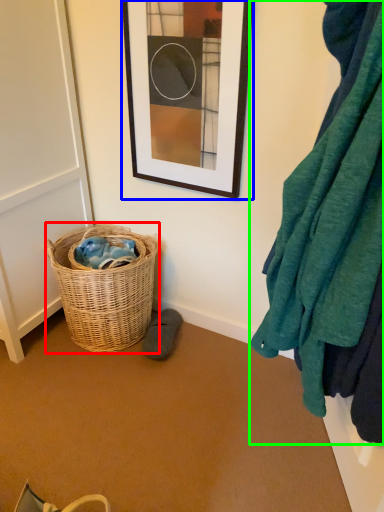
Question: Which object is positioned farthest from picnic basket (highlighted by a red box)? Select from picture frame (highlighted by a blue box) and blanket (highlighted by a green box).

Choices:
 (A) picture frame
 (B) blanket

Answer: (B)